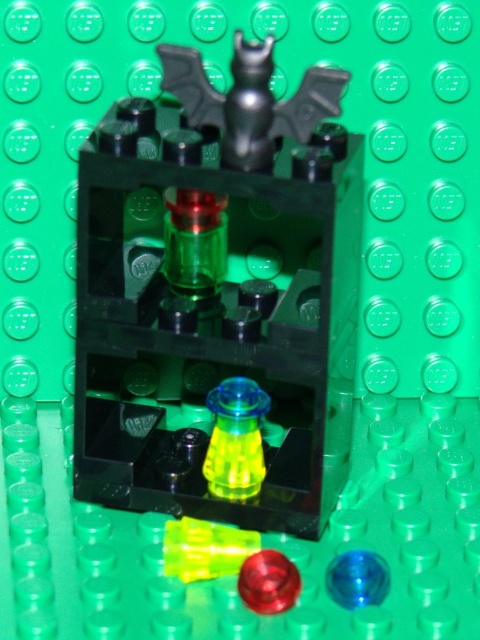
Is transparent plastic bat at upper center closer to the viewer compared to transparent blue sphere at center?

Yes.

Who is higher up, transparent plastic bat at upper center or transparent blue sphere at center?

transparent plastic bat at upper center is above.

Between point (196, 486) and point (371, 589), which one is positioned behind?

Positioned behind is point (196, 486).

Locate an element on the screen. This screenshot has height=640, width=480. transparent plastic bat at upper center is located at coordinates (217, 289).

Is shiny red button at center thinner than transparent blue sphere at center?

Incorrect, shiny red button at center's width is not less than transparent blue sphere at center's.

Does shiny red button at center appear on the left side of transparent blue sphere at center?

Yes, shiny red button at center is to the left of transparent blue sphere at center.

Does point (279, 586) come behind point (363, 557)?

No, (279, 586) is closer to viewer.

Image resolution: width=480 pixels, height=640 pixels. What are the coordinates of `shiny red button at center` in the screenshot? It's located at point(267,582).

Is translucent yellow plastic at center bigger than transparent blue sphere at center?

Indeed, translucent yellow plastic at center has a larger size compared to transparent blue sphere at center.

Which is in front, point (247, 394) or point (343, 570)?

Positioned in front is point (343, 570).

Image resolution: width=480 pixels, height=640 pixels. I want to click on translucent yellow plastic at center, so click(236, 440).